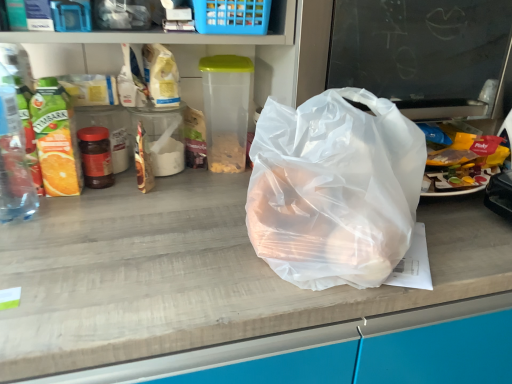
Describe the element at coordinates (13, 160) in the screenshot. I see `clear plastic bottle at left` at that location.

The height and width of the screenshot is (384, 512). What do you see at coordinates (232, 16) in the screenshot? I see `blue plastic basket at upper center` at bounding box center [232, 16].

Where is `transparent plastic bag at center`? The width and height of the screenshot is (512, 384). transparent plastic bag at center is located at coordinates (420, 52).

In the scene shown: Which object is wider, transparent plastic bag at center or clear plastic bottle at left?

Wider between the two is transparent plastic bag at center.

From the image's perspective, who appears lower, transparent plastic bag at center or clear plastic bottle at left?

From the image's view, clear plastic bottle at left is below.

Is transparent plastic bag at center not near clear plastic bottle at left?

No, there isn't a large distance between transparent plastic bag at center and clear plastic bottle at left.

Who is smaller, transparent plastic bag at center or clear plastic bottle at left?

clear plastic bottle at left.

Does blue plastic basket at upper center turn towards transparent plastic bag at center?

No, blue plastic basket at upper center does not turn towards transparent plastic bag at center.

How far apart are blue plastic basket at upper center and transparent plastic bag at center?

The distance of blue plastic basket at upper center from transparent plastic bag at center is 14.60 inches.

What's the angular difference between blue plastic basket at upper center and transparent plastic bag at center's facing directions?

The facing directions of blue plastic basket at upper center and transparent plastic bag at center are 3.1 degrees apart.

In terms of size, does blue plastic basket at upper center appear bigger or smaller than transparent plastic bag at center?

Clearly, blue plastic basket at upper center is smaller in size than transparent plastic bag at center.

Can you confirm if transparent plastic bag at center is wider than transparent plastic bag at center?

In fact, transparent plastic bag at center might be narrower than transparent plastic bag at center.

In the image, is transparent plastic bag at center positioned in front of or behind transparent plastic bag at center?

Clearly, transparent plastic bag at center is in front of transparent plastic bag at center.

Considering the relative sizes of transparent plastic bag at center and transparent plastic bag at center in the image provided, is transparent plastic bag at center bigger than transparent plastic bag at center?

Incorrect, transparent plastic bag at center is not larger than transparent plastic bag at center.

Would you consider transparent plastic bag at center to be distant from transparent plastic bag at center?

transparent plastic bag at center is near transparent plastic bag at center, not far away.

From the picture: Does clear plastic bottle at left turn towards transparent plastic bag at center?

No, clear plastic bottle at left is not facing towards transparent plastic bag at center.

Which of these two, clear plastic bottle at left or transparent plastic bag at center, is thinner?

With smaller width is clear plastic bottle at left.

Could transparent plastic bag at center be considered to be inside clear plastic bottle at left?

No, clear plastic bottle at left does not contain transparent plastic bag at center.

How many degrees apart are the facing directions of clear plastic bottle at left and blue plastic basket at upper center?

The angular difference between clear plastic bottle at left and blue plastic basket at upper center is 3.1 degrees.

Does point (28, 194) appear closer or farther from the camera than point (249, 31)?

Clearly, point (28, 194) is more distant from the camera than point (249, 31).

How distant is clear plastic bottle at left from blue plastic basket at upper center?

The distance of clear plastic bottle at left from blue plastic basket at upper center is 45.86 centimeters.

Is clear plastic bottle at left aimed at blue plastic basket at upper center?

No, clear plastic bottle at left is not facing towards blue plastic basket at upper center.

Does clear plastic bottle at left have a smaller size compared to transparent plastic bag at center?

Yes.

Based on the photo, is there a large distance between clear plastic bottle at left and transparent plastic bag at center?

No, clear plastic bottle at left is in close proximity to transparent plastic bag at center.

Where is `plastic bag below the clear plastic bottle at left (from a real-world perspective)`? plastic bag below the clear plastic bottle at left (from a real-world perspective) is located at coordinates (334, 189).

Is clear plastic bottle at left to the right of transparent plastic bag at center from the viewer's perspective?

No.

Can you tell me how much blue plastic basket at upper center and transparent plastic bag at center differ in facing direction?

They differ by 3.89 degrees in their facing directions.

Is blue plastic basket at upper center surrounding transparent plastic bag at center?

Actually, transparent plastic bag at center is outside blue plastic basket at upper center.

Is the position of blue plastic basket at upper center more distant than that of transparent plastic bag at center?

Yes, it is behind transparent plastic bag at center.

Is blue plastic basket at upper center directly adjacent to transparent plastic bag at center?

No, blue plastic basket at upper center is not beside transparent plastic bag at center.

The height and width of the screenshot is (384, 512). What are the coordinates of `writing on the right of the clear plastic bottle at left` in the screenshot? It's located at (420, 52).

Locate an element on the screen. basket on the left side of transparent plastic bag at center is located at coordinates (232, 16).

Which object lies nearer to the anchor point transparent plastic bag at center, blue plastic basket at upper center or clear plastic bottle at left?

blue plastic basket at upper center is positioned closer to the anchor transparent plastic bag at center.

From the image, which object appears to be farther from transparent plastic bag at center, clear plastic bottle at left or blue plastic basket at upper center?

Among the two, clear plastic bottle at left is located further to transparent plastic bag at center.

Estimate the real-world distances between objects in this image. Which object is further from blue plastic basket at upper center, transparent plastic bag at center or transparent plastic bag at center?

transparent plastic bag at center lies further to blue plastic basket at upper center than the other object.

Considering their positions, is blue plastic basket at upper center positioned closer to transparent plastic bag at center than clear plastic bottle at left?

blue plastic basket at upper center is positioned closer to the anchor transparent plastic bag at center.

When comparing their distances from transparent plastic bag at center, does blue plastic basket at upper center or transparent plastic bag at center seem further?

blue plastic basket at upper center.

Looking at the image, which one is located further to blue plastic basket at upper center, transparent plastic bag at center or transparent plastic bag at center?

Among the two, transparent plastic bag at center is located further to blue plastic basket at upper center.

Which object lies nearer to the anchor point blue plastic basket at upper center, clear plastic bottle at left or transparent plastic bag at center?

transparent plastic bag at center is positioned closer to the anchor blue plastic basket at upper center.

Estimate the real-world distances between objects in this image. Which object is closer to transparent plastic bag at center, clear plastic bottle at left or transparent plastic bag at center?

transparent plastic bag at center is positioned closer to the anchor transparent plastic bag at center.

Locate an element on the screen. plastic bag situated between blue plastic basket at upper center and transparent plastic bag at center from left to right is located at coordinates (334, 189).

At what (x,y) coordinates should I click in order to perform the action: click on plastic bag between clear plastic bottle at left and transparent plastic bag at center. Please return your answer as a coordinate pair (x, y). This screenshot has height=384, width=512. Looking at the image, I should click on (334, 189).

Locate an element on the screen. The width and height of the screenshot is (512, 384). basket situated between clear plastic bottle at left and transparent plastic bag at center from left to right is located at coordinates (232, 16).

Image resolution: width=512 pixels, height=384 pixels. Identify the location of basket located between clear plastic bottle at left and transparent plastic bag at center in the left-right direction. (232, 16).